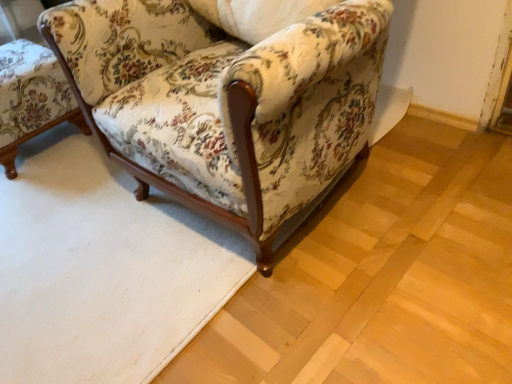
Question: From the image's perspective, is wooden armchair at left, the first chair from the left, above or below floral fabric chair at center, which is the first chair in right-to-left order?

Choices:
 (A) below
 (B) above

Answer: (B)

Question: Is point (48, 127) positioned closer to the camera than point (269, 119)?

Choices:
 (A) closer
 (B) farther

Answer: (B)

Question: From their relative heights in the image, would you say wooden armchair at left, the first chair from the left, is taller or shorter than floral fabric chair at center, acting as the 2th chair starting from the left?

Choices:
 (A) tall
 (B) short

Answer: (B)

Question: In the image, is floral fabric chair at center, acting as the 2th chair starting from the left, on the left side or the right side of wooden armchair at left, the first chair from the left?

Choices:
 (A) right
 (B) left

Answer: (A)

Question: Considering the positions of floral fabric chair at center, acting as the 2th chair starting from the left, and wooden armchair at left, the first chair from the left, in the image, is floral fabric chair at center, acting as the 2th chair starting from the left, taller or shorter than wooden armchair at left, the first chair from the left,?

Choices:
 (A) tall
 (B) short

Answer: (A)

Question: Is floral fabric chair at center, acting as the 2th chair starting from the left, inside or outside of wooden armchair at left, the first chair from the left?

Choices:
 (A) outside
 (B) inside

Answer: (A)

Question: From the image's perspective, is floral fabric chair at center, acting as the 2th chair starting from the left, located above or below wooden armchair at left, the first chair from the left?

Choices:
 (A) below
 (B) above

Answer: (A)